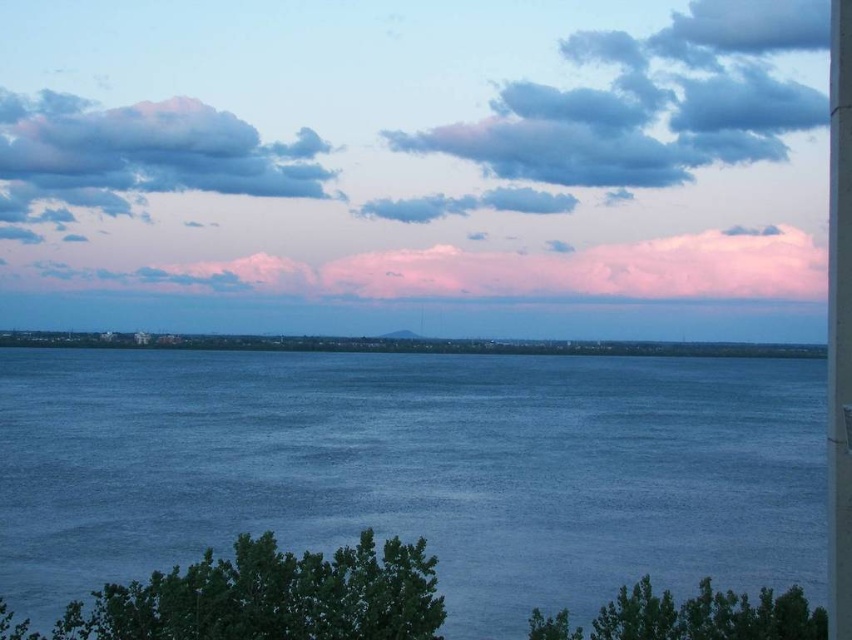
Who is shorter, blue water at center or smooth concrete pillar at right?

Standing shorter between the two is blue water at center.

Is blue water at center to the right of smooth concrete pillar at right from the viewer's perspective?

In fact, blue water at center is to the left of smooth concrete pillar at right.

Between point (816, 428) and point (830, 17), which one is positioned behind?

The point (830, 17) is behind.

The height and width of the screenshot is (640, 852). Identify the location of blue water at center. (413, 465).

Does cloudy sky at upper left have a lesser width compared to smooth concrete pillar at right?

Indeed, cloudy sky at upper left has a lesser width compared to smooth concrete pillar at right.

Which is behind, point (59, 221) or point (838, 200)?

The point (59, 221) is behind.

Is point (239, 160) in front of point (843, 541)?

No, it is behind (843, 541).

Where is `cloudy sky at upper left`? This screenshot has height=640, width=852. cloudy sky at upper left is located at coordinates (137, 156).

Looking at this image, is pink cotton clouds at upper center positioned at the back of pink fluffy cloud at upper center?

Yes, pink cotton clouds at upper center is behind pink fluffy cloud at upper center.

Can you confirm if pink cotton clouds at upper center is positioned to the left of pink fluffy cloud at upper center?

Yes, pink cotton clouds at upper center is to the left of pink fluffy cloud at upper center.

Is point (606, 193) less distant than point (312, 276)?

That is False.

At what (x,y) coordinates should I click in order to perform the action: click on pink cotton clouds at upper center. Please return your answer as a coordinate pair (x, y). The image size is (852, 640). Looking at the image, I should click on (417, 148).